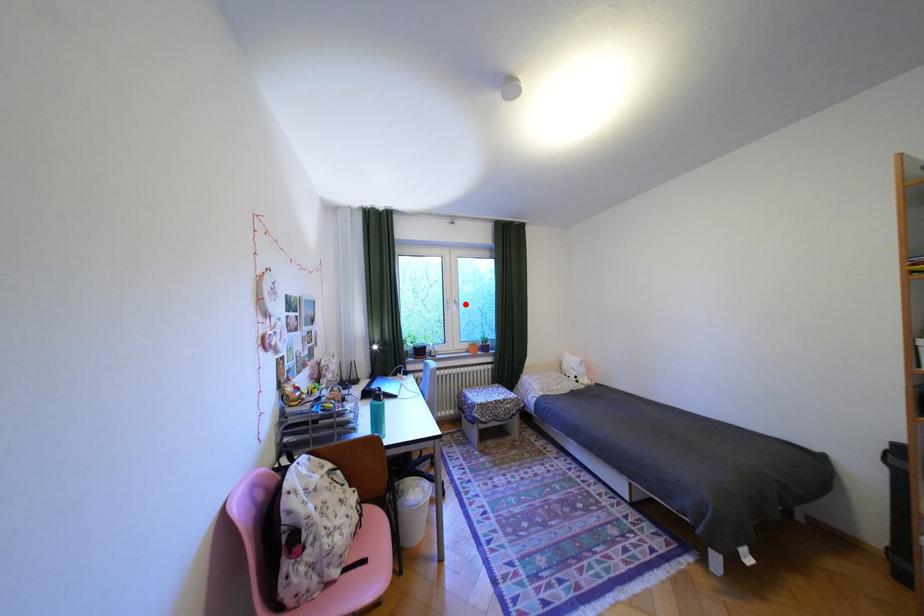
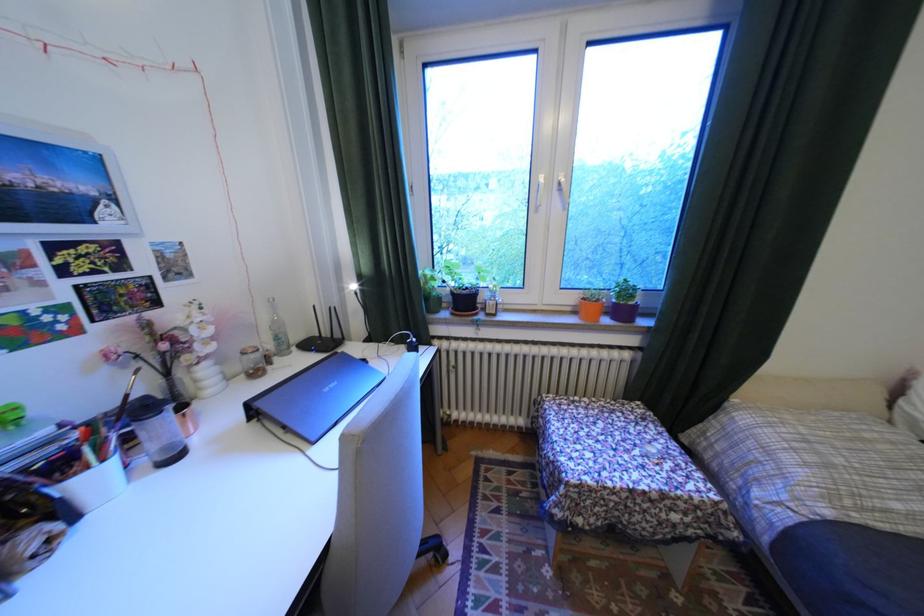
In the second image, find the point that corresponds to the highlighted location in the first image.

(566, 195)